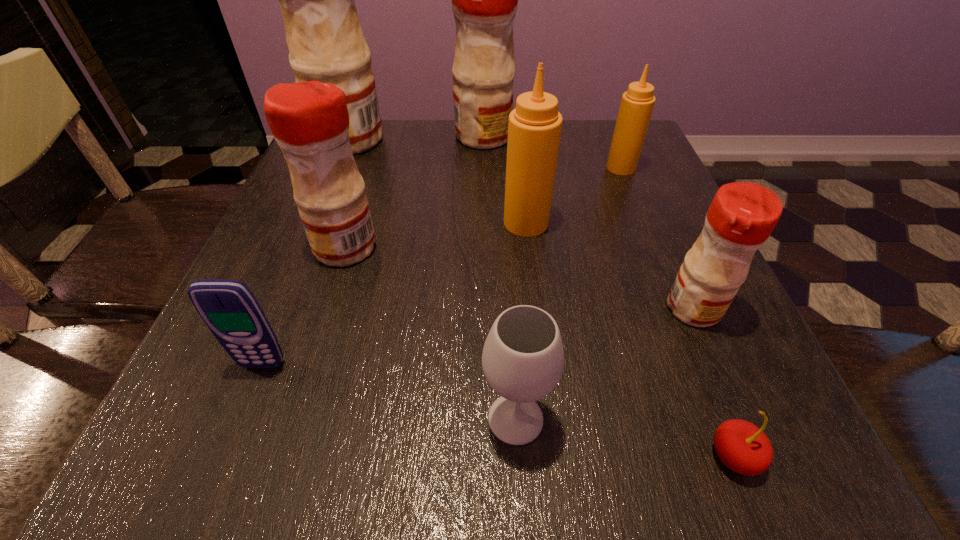
At what (x,y) coordinates should I click in order to perform the action: click on the nearest red condiment. Please return your answer as a coordinate pair (x, y). Image resolution: width=960 pixels, height=540 pixels. Looking at the image, I should click on (742, 215).

Locate an element on the screen. wineglass is located at coordinates (523, 357).

What are the coordinates of `cellular telephone` in the screenshot? It's located at (228, 307).

Locate an element on the screen. This screenshot has width=960, height=540. the shortest object is located at coordinates (744, 448).

Locate an element on the screen. The width and height of the screenshot is (960, 540). cherry is located at coordinates (744, 448).

Where is `vacant area located 0.400m on the right of the tallest object`? vacant area located 0.400m on the right of the tallest object is located at coordinates (547, 139).

Identify the location of vacant region located 0.100m on the left of the fifth shortest condiment. (415, 137).

Find the location of a particular element. The width and height of the screenshot is (960, 540). vacant space located 0.290m on the left of the nearer tan condiment is located at coordinates (354, 222).

Identify the location of vacant position located 0.250m on the back of the third biggest red condiment. (373, 158).

This screenshot has width=960, height=540. I want to click on vacant space positioned on the right of the smaller tan condiment, so (662, 168).